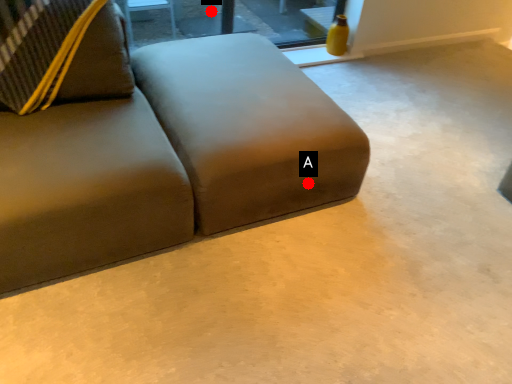
Question: Two points are circled on the image, labeled by A and B beside each circle. Which of the following is the farthest from the observer?

Choices:
 (A) A is further
 (B) B is further

Answer: (B)